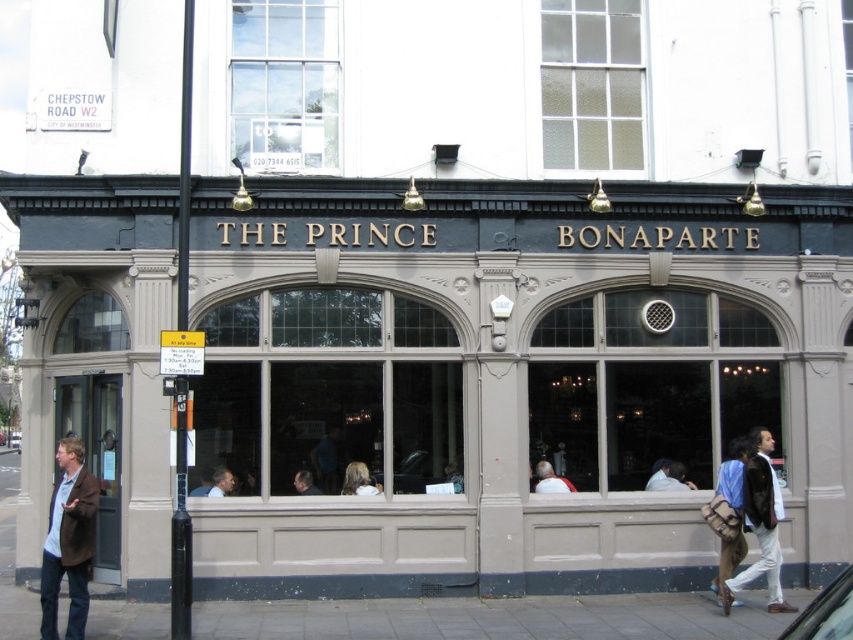
Question: Does matte gray building at center appear over gray concrete sidewalk at lower center?

Choices:
 (A) no
 (B) yes

Answer: (B)

Question: Is brown leather jacket at lower right positioned behind smooth brown hair at center?

Choices:
 (A) no
 (B) yes

Answer: (A)

Question: Does smooth brown hair at center have a lesser width compared to dark brown leather jacket at center?

Choices:
 (A) yes
 (B) no

Answer: (A)

Question: Which point is closer to the camera taking this photo?

Choices:
 (A) (309, 474)
 (B) (561, 490)

Answer: (A)

Question: Which object is closer to the camera taking this photo?

Choices:
 (A) light brown leather jacket at center
 (B) brown leather jacket at lower right

Answer: (B)

Question: Which point is farther to the camera?

Choices:
 (A) light brown leather jacket at center
 (B) matte gray building at center
 (C) smooth brown hair at center

Answer: (A)